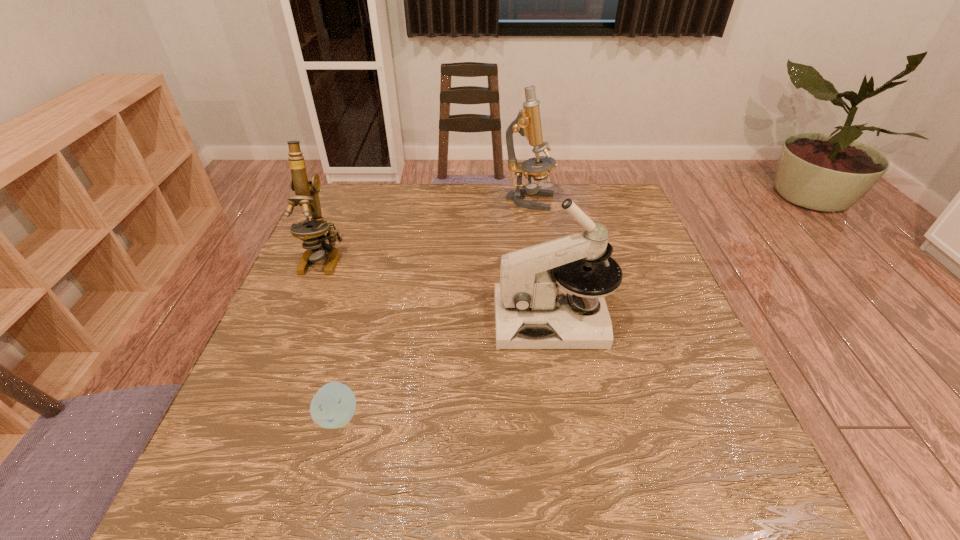
Identify the location of blank space at the far right corner of the desktop. The height and width of the screenshot is (540, 960). 589,200.

This screenshot has height=540, width=960. I want to click on free space at the near right corner, so click(x=719, y=462).

I want to click on free spot between the third farthest object and the second farthest microscope, so click(438, 289).

Locate an element on the screen. vacant area that lies between the farthest microscope and the apple is located at coordinates (434, 309).

This screenshot has height=540, width=960. In order to click on vacant area that lies between the farthest microscope and the nearest object in this screenshot , I will do `click(434, 309)`.

Locate an element on the screen. The image size is (960, 540). free space that is in between the nearest object and the nearest microscope is located at coordinates (445, 368).

Find the location of `vacant point located between the second object from left to right and the second nearest object`. vacant point located between the second object from left to right and the second nearest object is located at coordinates (445, 368).

The width and height of the screenshot is (960, 540). In order to click on free space between the leftmost object and the shortest object in this screenshot , I will do `click(331, 337)`.

Image resolution: width=960 pixels, height=540 pixels. What are the coordinates of `free space between the leftmost object and the farthest object` in the screenshot? It's located at (426, 230).

Find the location of `vacant area that lies between the second farthest microscope and the nearest microscope`. vacant area that lies between the second farthest microscope and the nearest microscope is located at coordinates (438, 289).